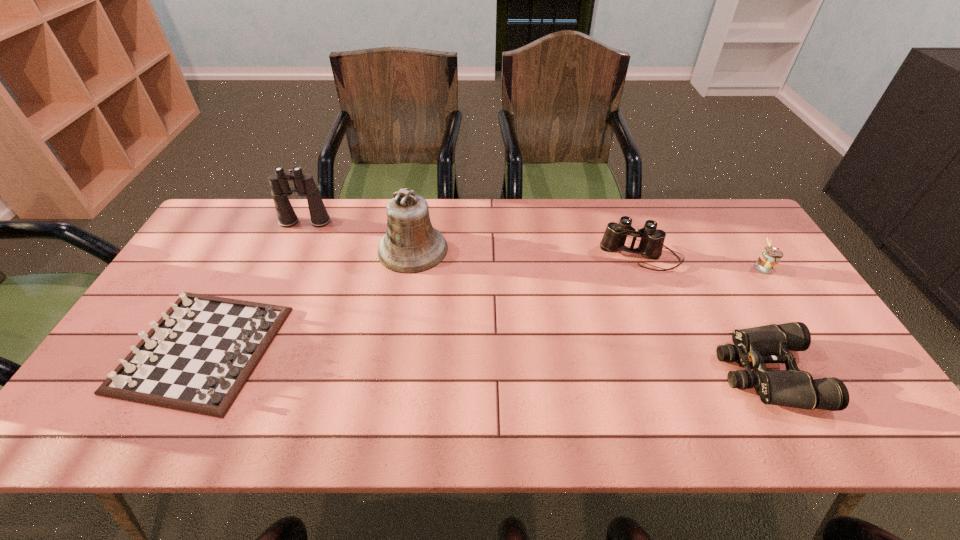
Find the location of `empty space between the fourth tallest object and the chessboard`. empty space between the fourth tallest object and the chessboard is located at coordinates (482, 308).

Select which object appears as the closest to the farthest binoculars. Please provide its 2D coordinates. Your answer should be formatted as a tuple, i.e. [(x, y)], where the tuple contains the x and y coordinates of a point satisfying the conditions above.

[(411, 245)]

This screenshot has height=540, width=960. Identify the location of object that stands as the second closest to the chessboard. (280, 189).

Where is `the second closest binoculars relative to the chessboard`? This screenshot has width=960, height=540. the second closest binoculars relative to the chessboard is located at coordinates (651, 244).

The width and height of the screenshot is (960, 540). I want to click on binoculars that is the second closest one to the farthest binoculars, so click(753, 347).

Locate an element on the screen. The image size is (960, 540). vacant space that satisfies the following two spatial constraints: 1. on the front side of the rightmost object; 2. through the eyepieces of the nearest binoculars is located at coordinates (831, 373).